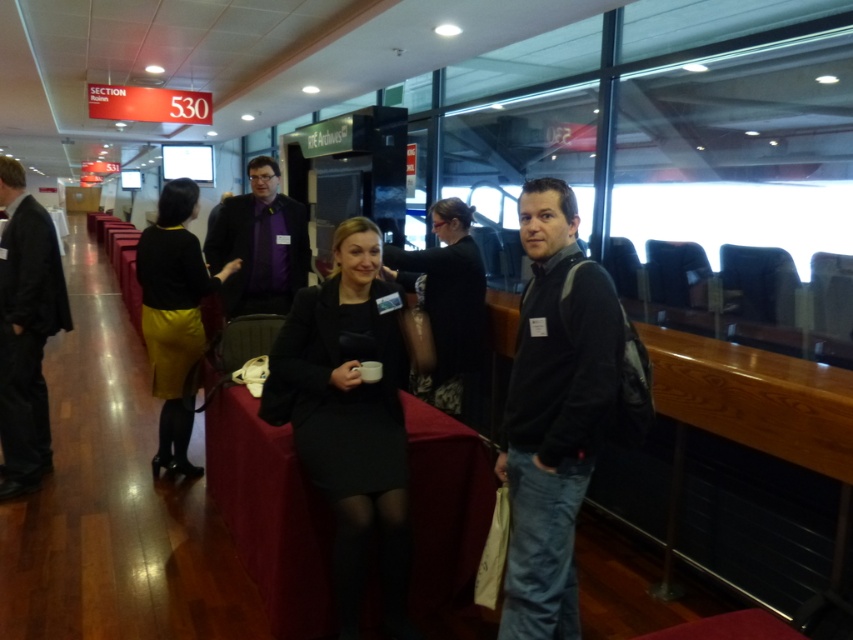
Question: Which point is farther to the camera?

Choices:
 (A) black matte dress at center
 (B) black suit at left
 (C) matte black suit at center

Answer: (C)

Question: Which of the following is the closest to the observer?

Choices:
 (A) (39, 268)
 (B) (465, 392)
 (C) (172, 285)

Answer: (A)

Question: Is smooth black table at center below matte black sweater at center?

Choices:
 (A) yes
 (B) no

Answer: (A)

Question: Which point is farther from the camera taking this photo?

Choices:
 (A) (190, 339)
 (B) (334, 253)

Answer: (A)

Question: Does black suit at left appear on the right side of black dress at center?

Choices:
 (A) no
 (B) yes

Answer: (A)

Question: Is dark gray fleece jacket at center thinner than smooth black table at center?

Choices:
 (A) yes
 (B) no

Answer: (A)